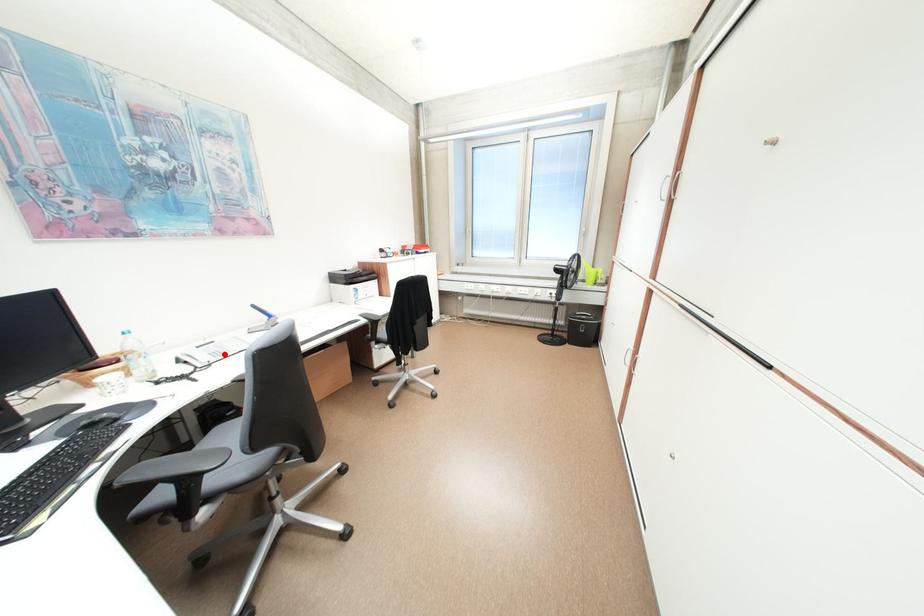
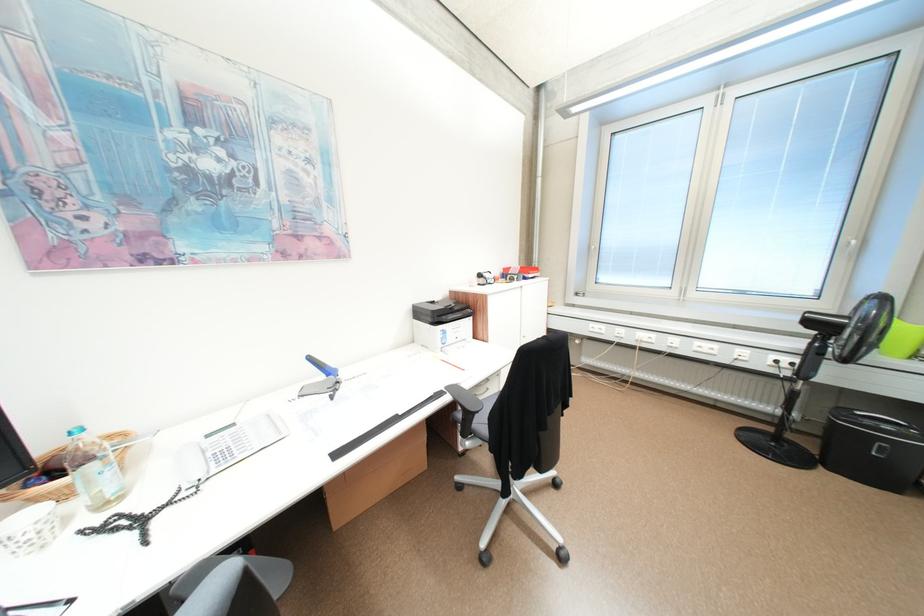
Locate, in the second image, the point that corresponds to the highlighted location in the first image.

(231, 456)